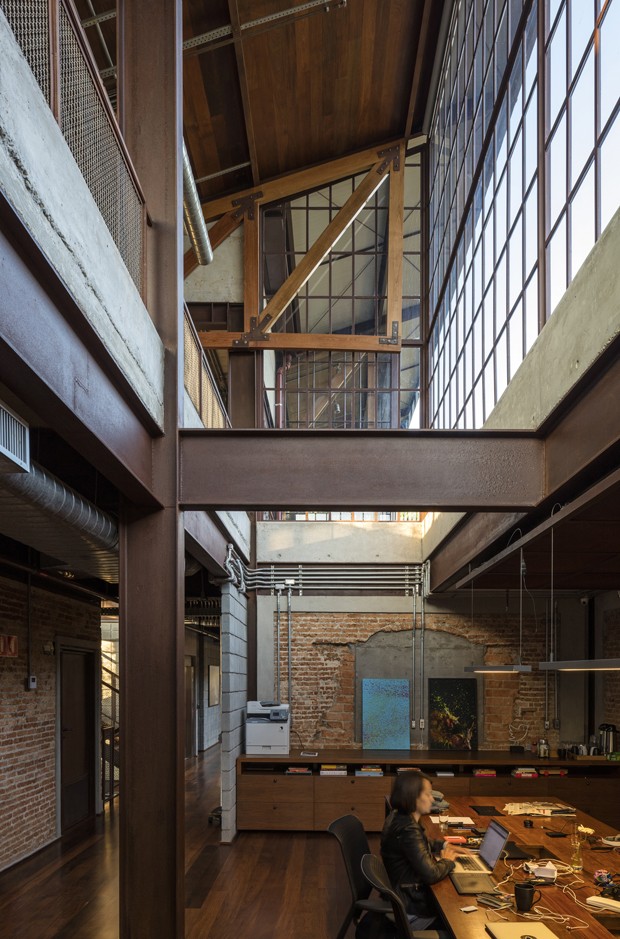
Locate an element on the screen. The height and width of the screenshot is (939, 620). wall is located at coordinates (294, 648).